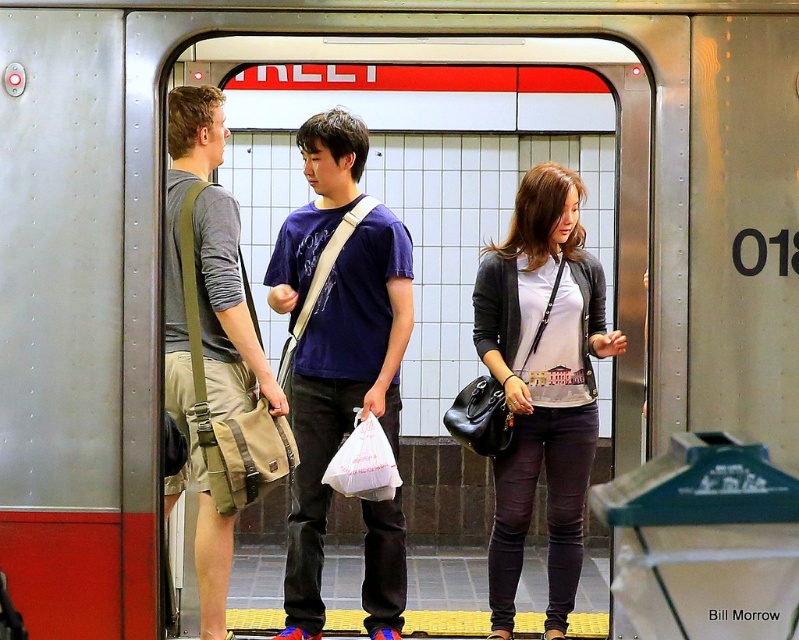
You are a passenger waiting for the train at the subway station. You notice a matte black purse at center and khaki shorts at left. Which object is closer to you as you stand facing the platform?

The matte black purse at center is closer to you because the khaki shorts at left is behind it.